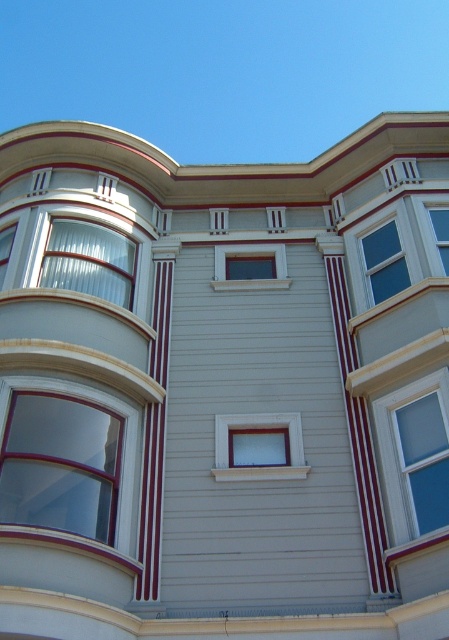
Measure the distance between point (73, 435) and camera.

Point (73, 435) is 41.64 feet from camera.

Which is more to the left, matte glass window at left or matte glass window at center?

From the viewer's perspective, matte glass window at left appears more on the left side.

Who is more distant from viewer, (29, 454) or (237, 244)?

The point (237, 244) is behind.

Image resolution: width=449 pixels, height=640 pixels. I want to click on matte glass window at left, so click(x=61, y=465).

Is point (246, 442) positioned in front of point (377, 244)?

Yes, point (246, 442) is closer to viewer.

Where is `matte white window at center`? matte white window at center is located at coordinates (259, 448).

Between point (296, 442) and point (372, 289), which one is positioned behind?

The point (372, 289) is behind.

I want to click on matte white window at center, so click(259, 448).

Can you confirm if white glass window at center is wider than matte white window at center?

No, white glass window at center is not wider than matte white window at center.

Can you confirm if white glass window at center is positioned to the right of matte white window at center?

Correct, you'll find white glass window at center to the right of matte white window at center.

You are a GUI agent. You are given a task and a screenshot of the screen. Output one action in this format:
    pyautogui.click(x=<x>, y=<y>)
    Task: Click on the white glass window at center
    This screenshot has width=449, height=640.
    Given the screenshot: What is the action you would take?
    pyautogui.click(x=414, y=454)

This screenshot has width=449, height=640. I want to click on white glass window at center, so click(x=414, y=454).